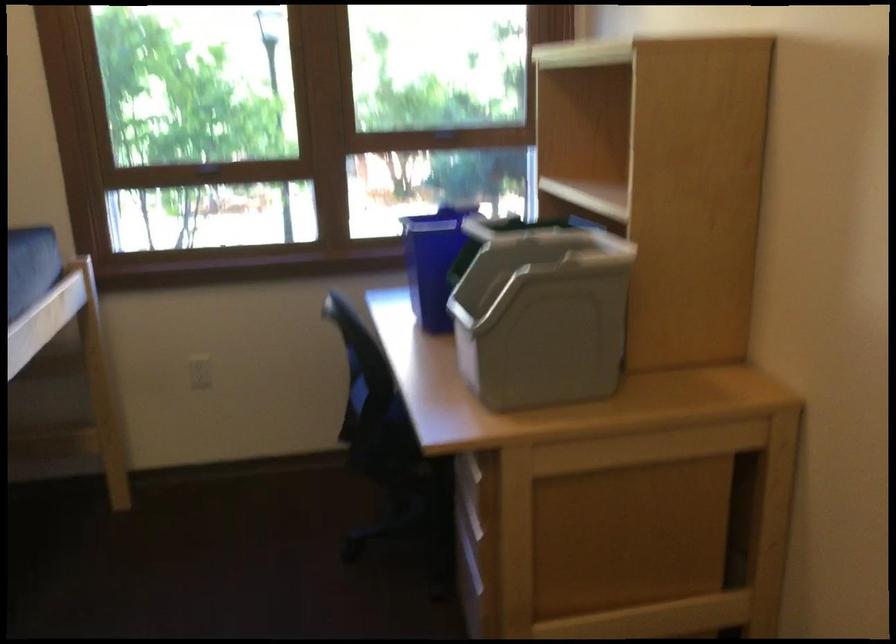
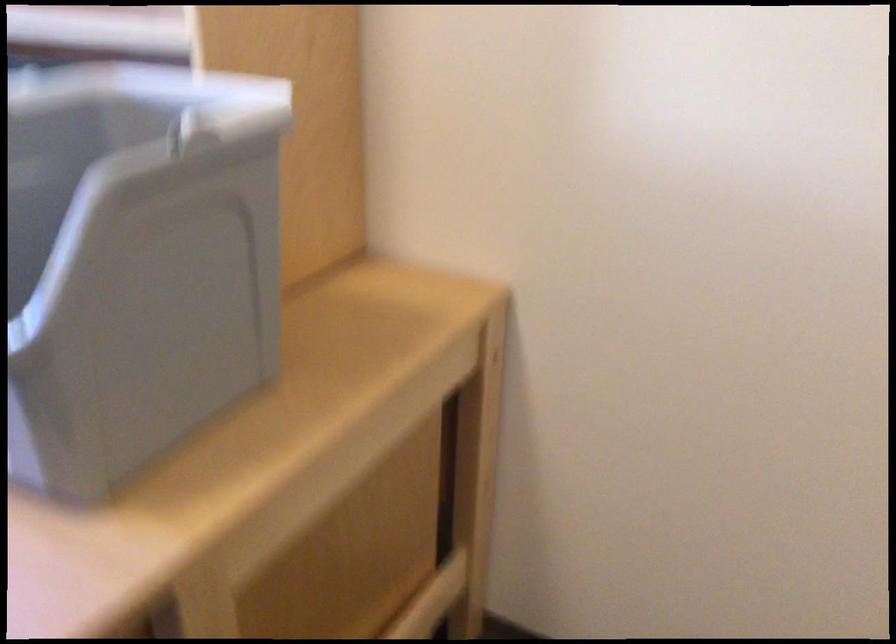
The point at (530, 312) is marked in the first image. Where is the corresponding point in the second image?

(135, 263)